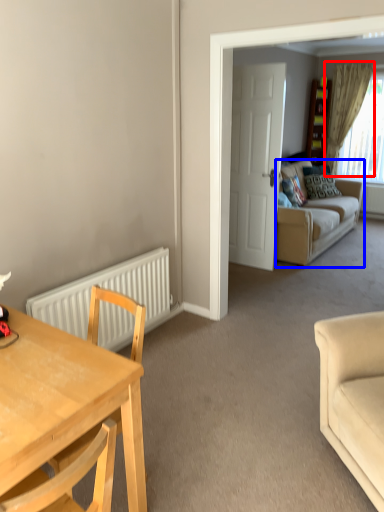
Question: Which object is further to the camera taking this photo, curtain (highlighted by a red box) or studio couch (highlighted by a blue box)?

Choices:
 (A) curtain
 (B) studio couch

Answer: (A)